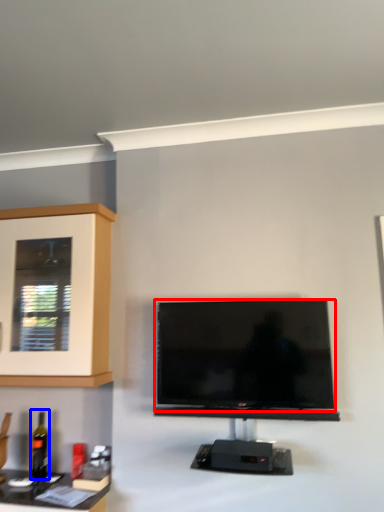
Question: Which point is closer to the camera, television (highlighted by a red box) or bottle (highlighted by a blue box)?

Choices:
 (A) television
 (B) bottle

Answer: (A)